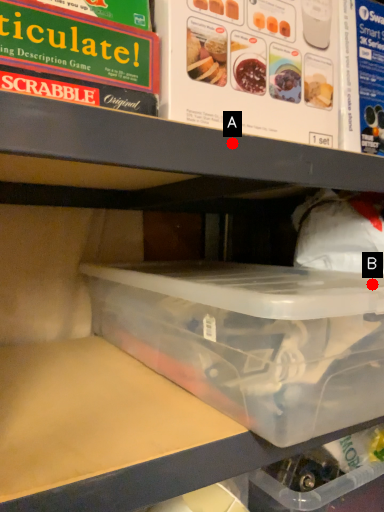
Question: Two points are circled on the image, labeled by A and B beside each circle. Which point is farther to the camera?

Choices:
 (A) A is further
 (B) B is further

Answer: (B)